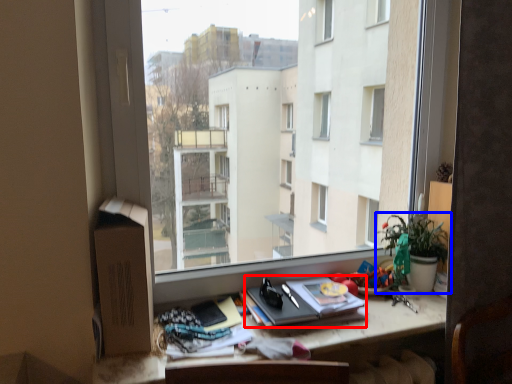
Question: Which of the following is the closest to the observer, paperback book (highlighted by a red box) or houseplant (highlighted by a blue box)?

Choices:
 (A) paperback book
 (B) houseplant

Answer: (A)